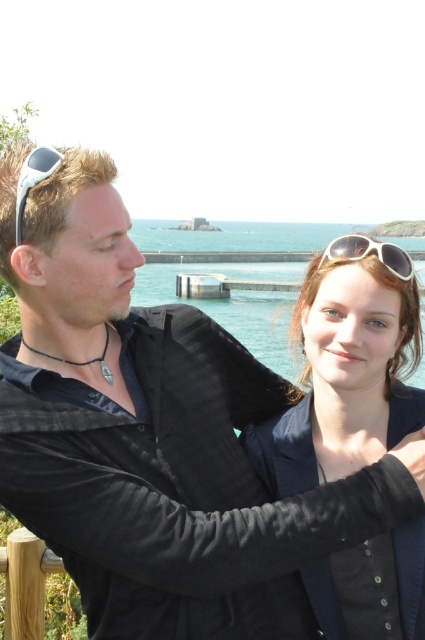
You are a photographer trying to capture the reflection of the white plastic sunglasses at upper center in the ocean. Since the sunglasses are at point (x=370, y=253), where should you aim your camera to ensure the reflection is visible in the water?

The reflection of the white plastic sunglasses at upper center would be directly below the point (x=370, y=253) in the water. To capture the reflection, aim your camera towards the water surface at the same horizontal position as the sunglasses but slightly lower vertically to account for the water level.

You are standing at the point marked as point (328,428) and want to take a photo of the two people in the scene. Considering your camera has a maximum focus range of 10 meters, will you be able to capture them clearly?

The distance from point (328,428) to the viewer is 8.08 meters, which is within the camera maximum focus range of 10 meters. Therefore, you can capture them clearly.

You are a photographer trying to capture a closeup of the matte black jacket at center and the white plastic sunglasses at upper center. Since you want to focus on both items clearly, which object should you adjust your camera focus on first?

The matte black jacket at center occupies less space than the white plastic sunglasses at upper center, so you should focus on the matte black jacket at center first because it is smaller and requires precise focus.